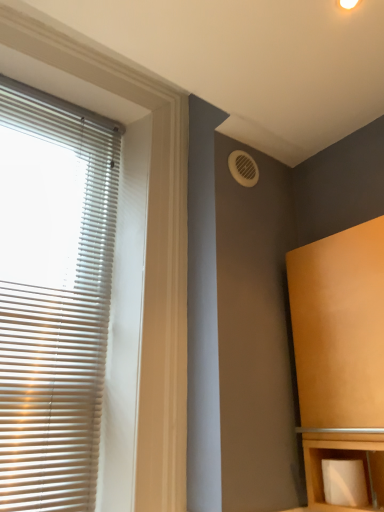
Measure the distance between matte wood cabinet at right and camera.

matte wood cabinet at right is 3.38 feet away from camera.

Identify the location of white matte toilet paper at lower right. (344, 482).

Is white matte toilet paper at lower right closer to camera compared to matte wood cabinet at right?

No, white matte toilet paper at lower right is behind matte wood cabinet at right.

From the image's perspective, which one is positioned lower, white matte toilet paper at lower right or matte wood cabinet at right?

From the image's view, white matte toilet paper at lower right is below.

Would you say white matte toilet paper at lower right is a long distance from matte wood cabinet at right?

No, there isn't a large distance between white matte toilet paper at lower right and matte wood cabinet at right.

Does white matte toilet paper at lower right have a lesser width compared to matte wood cabinet at right?

Yes, white matte toilet paper at lower right is thinner than matte wood cabinet at right.

Between matte wood cabinet at right and white plastic vent at upper right, which one appears on the right side from the viewer's perspective?

matte wood cabinet at right is more to the right.

At what (x,y) coordinates should I click in order to perform the action: click on furniture in front of the white plastic vent at upper right. Please return your answer as a coordinate pair (x, y). Image resolution: width=384 pixels, height=512 pixels. Looking at the image, I should click on (340, 354).

From a real-world perspective, is matte wood cabinet at right positioned over white plastic vent at upper right based on gravity?

Actually, matte wood cabinet at right is physically below white plastic vent at upper right in the real world.

Is point (380, 261) less distant than point (243, 184)?

Yes, point (380, 261) is closer to viewer.

Based on the photo, considering the sizes of objects white plastic vent at upper right and white matte blinds at left in the image provided, who is shorter, white plastic vent at upper right or white matte blinds at left?

With less height is white plastic vent at upper right.

Would you consider white plastic vent at upper right to be distant from white matte blinds at left?

white plastic vent at upper right is near white matte blinds at left, not far away.

Is white plastic vent at upper right looking in the opposite direction of white matte blinds at left?

No, white plastic vent at upper right's orientation is not away from white matte blinds at left.

From the image's perspective, would you say white plastic vent at upper right is positioned over white matte blinds at left?

Yes, from the image's perspective, white plastic vent at upper right is on top of white matte blinds at left.

Can you confirm if white matte toilet paper at lower right is wider than white matte blinds at left?

Yes.

From the picture: Does white matte toilet paper at lower right appear on the right side of white matte blinds at left?

Indeed, white matte toilet paper at lower right is positioned on the right side of white matte blinds at left.

Is white matte toilet paper at lower right oriented away from white matte blinds at left?

No, white matte toilet paper at lower right is not facing away from white matte blinds at left.

Locate an element on the screen. toilet paper on the right side of white matte blinds at left is located at coordinates (344, 482).

Consider the image. Between white matte blinds at left and matte wood cabinet at right, which one has smaller width?

white matte blinds at left is thinner.

Can you tell me how much white matte blinds at left and matte wood cabinet at right differ in facing direction?

They differ by 90.5 degrees in their facing directions.

Is the surface of white matte blinds at left in direct contact with matte wood cabinet at right?

white matte blinds at left is not next to matte wood cabinet at right, and they're not touching.

Can you confirm if white matte blinds at left is shorter than matte wood cabinet at right?

No, white matte blinds at left is not shorter than matte wood cabinet at right.

What's the angular difference between matte wood cabinet at right and white matte blinds at left's facing directions?

The facing directions of matte wood cabinet at right and white matte blinds at left are 90.5 degrees apart.

From a real-world perspective, which is physically above, matte wood cabinet at right or white matte blinds at left?

white matte blinds at left, from a real-world perspective.

Considering the relative positions of matte wood cabinet at right and white matte blinds at left in the image provided, is matte wood cabinet at right to the right of white matte blinds at left from the viewer's perspective?

Yes.

Is matte wood cabinet at right facing away from white matte blinds at left?

matte wood cabinet at right is not turned away from white matte blinds at left.

Does matte wood cabinet at right have a greater width compared to white matte toilet paper at lower right?

Correct, the width of matte wood cabinet at right exceeds that of white matte toilet paper at lower right.

Does matte wood cabinet at right come in front of white matte toilet paper at lower right?

That is True.

Is matte wood cabinet at right far from white matte toilet paper at lower right?

No.

Identify the location of toilet paper on the left of matte wood cabinet at right. (344, 482).

The height and width of the screenshot is (512, 384). In the image, there is a matte wood cabinet at right. Find the location of `air conditioning above it (from the image's perspective)`. air conditioning above it (from the image's perspective) is located at coordinates (243, 168).

Which object lies nearer to the anchor point white plastic vent at upper right, white matte toilet paper at lower right or matte wood cabinet at right?

Based on the image, matte wood cabinet at right appears to be nearer to white plastic vent at upper right.

Considering their positions, is white plastic vent at upper right positioned further to white matte blinds at left than white matte toilet paper at lower right?

white matte toilet paper at lower right.

Which object lies nearer to the anchor point white matte toilet paper at lower right, white plastic vent at upper right or white matte blinds at left?

Based on the image, white matte blinds at left appears to be nearer to white matte toilet paper at lower right.

Considering their positions, is matte wood cabinet at right positioned further to white matte blinds at left than white matte toilet paper at lower right?

white matte toilet paper at lower right.

Estimate the real-world distances between objects in this image. Which object is closer to white matte blinds at left, white plastic vent at upper right or matte wood cabinet at right?

white plastic vent at upper right.

Which object lies nearer to the anchor point white matte toilet paper at lower right, white matte blinds at left or white plastic vent at upper right?

white matte blinds at left lies closer to white matte toilet paper at lower right than the other object.

Estimate the real-world distances between objects in this image. Which object is further from white plastic vent at upper right, white matte blinds at left or white matte toilet paper at lower right?

white matte toilet paper at lower right.

Considering their positions, is white matte toilet paper at lower right positioned closer to white plastic vent at upper right than white matte blinds at left?

white matte blinds at left lies closer to white plastic vent at upper right than the other object.

What are the coordinates of `furniture between white plastic vent at upper right and white matte toilet paper at lower right from top to bottom` in the screenshot? It's located at (340, 354).

Where is `window blind between white plastic vent at upper right and white matte toilet paper at lower right in the up-down direction`? This screenshot has height=512, width=384. window blind between white plastic vent at upper right and white matte toilet paper at lower right in the up-down direction is located at coordinates (53, 295).

The image size is (384, 512). I want to click on toilet paper between white matte blinds at left and matte wood cabinet at right, so click(344, 482).

At what (x,y) coordinates should I click in order to perform the action: click on air conditioning between white matte blinds at left and matte wood cabinet at right from left to right. Please return your answer as a coordinate pair (x, y). Looking at the image, I should click on (243, 168).